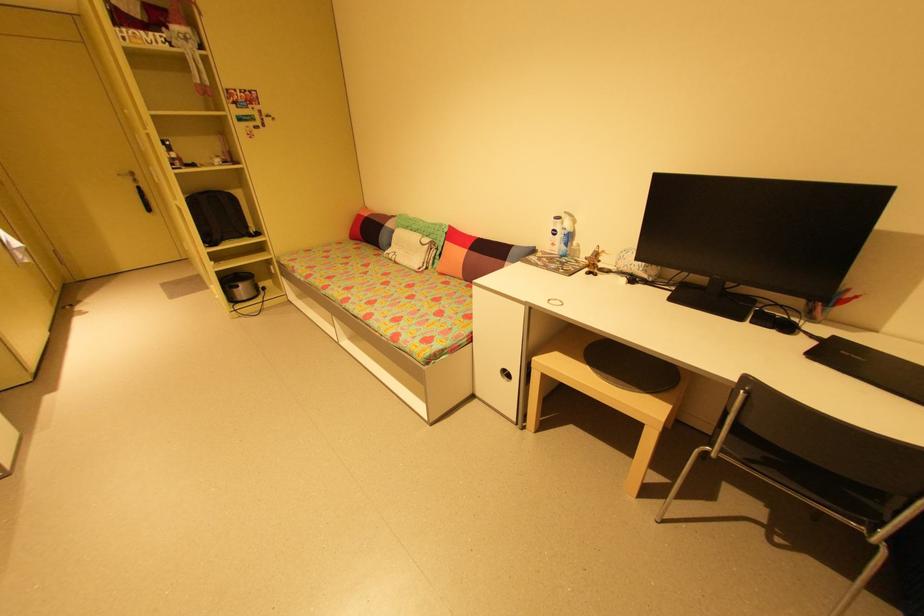
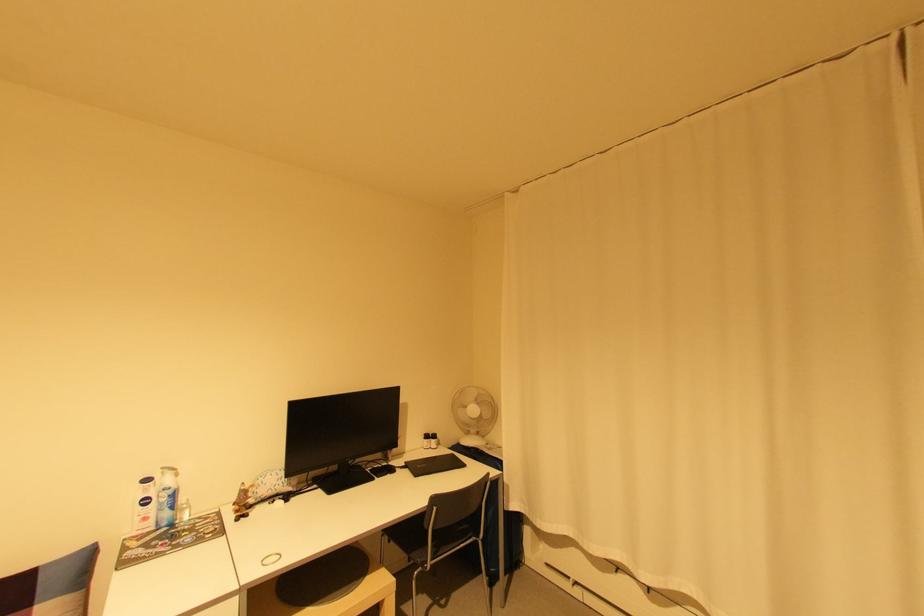
Question: How did the camera likely rotate?

Choices:
 (A) Left
 (B) Right
 (C) Up
 (D) Down

Answer: (B)